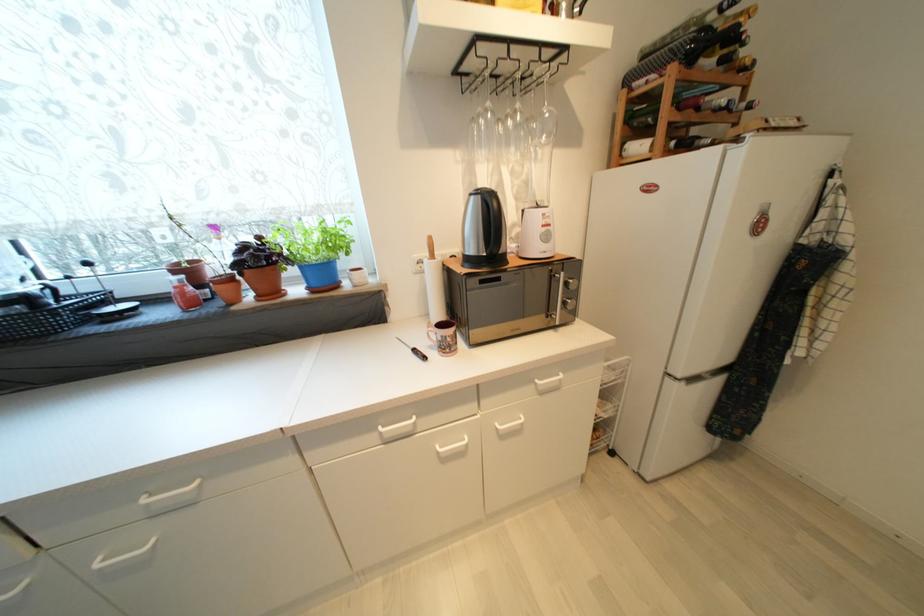
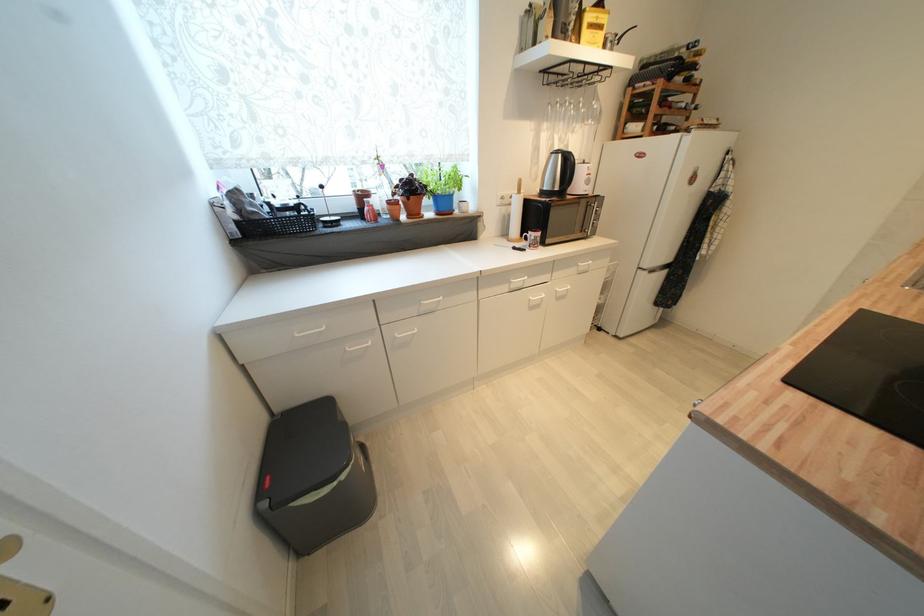
Question: I am providing you with two images of the same scene from different viewpoints. After the viewpoint changes to image2, which objects are now occluded?

Choices:
 (A) wine glass
 (B) microwave door handle
 (C) brown liquor bottle
 (D) none of these

Answer: (D)